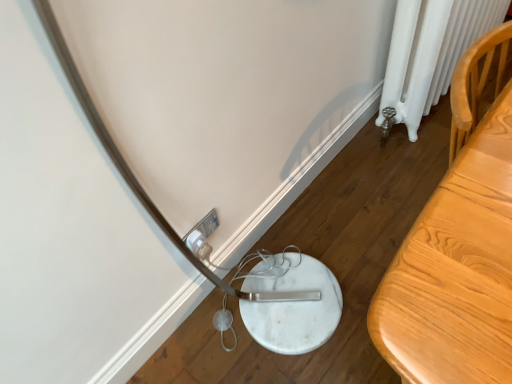
This screenshot has width=512, height=384. I want to click on free space that is to the left of light wood table at right, so click(x=347, y=257).